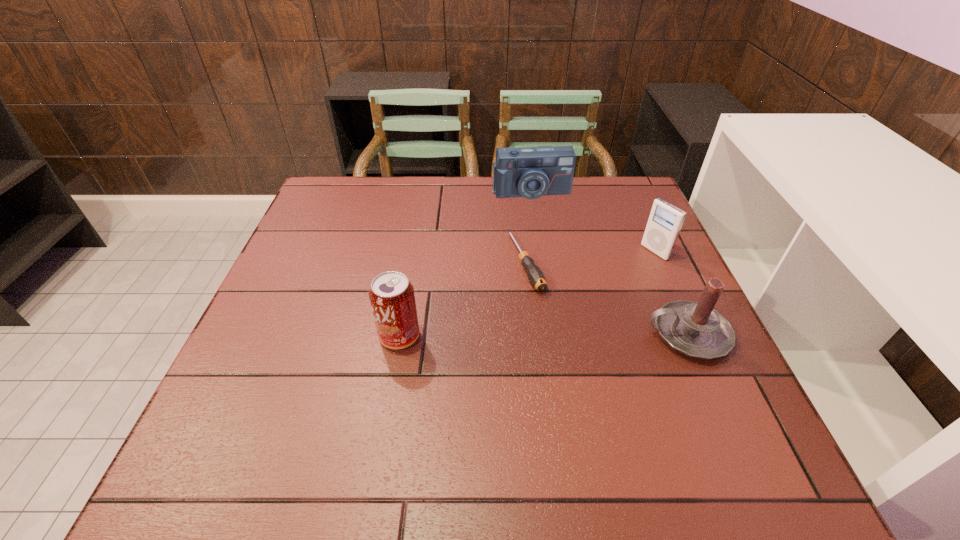
Locate an element on the screen. This screenshot has height=540, width=960. soda can is located at coordinates [x=392, y=298].

The width and height of the screenshot is (960, 540). In order to click on candle in this screenshot , I will do `click(695, 329)`.

Find the location of a particular element. iPod is located at coordinates (665, 221).

Identify the location of screwdriver. tap(534, 274).

Locate an element on the screen. camera is located at coordinates (531, 172).

The width and height of the screenshot is (960, 540). Find the location of `free location located 0.250m on the back of the soda can`. free location located 0.250m on the back of the soda can is located at coordinates (415, 249).

Find the location of a particular element. This screenshot has width=960, height=540. free point located 0.080m on the side of the candle with the handle loop is located at coordinates click(608, 334).

In order to click on free region located 0.310m on the side of the candle with the handle loop in this screenshot , I will do [x=501, y=334].

This screenshot has height=540, width=960. What are the coordinates of `free space located on the side of the candle with the handle loop` in the screenshot? It's located at (492, 334).

Locate an element on the screen. Image resolution: width=960 pixels, height=540 pixels. vacant space located 0.190m on the front-facing side of the iPod is located at coordinates (595, 287).